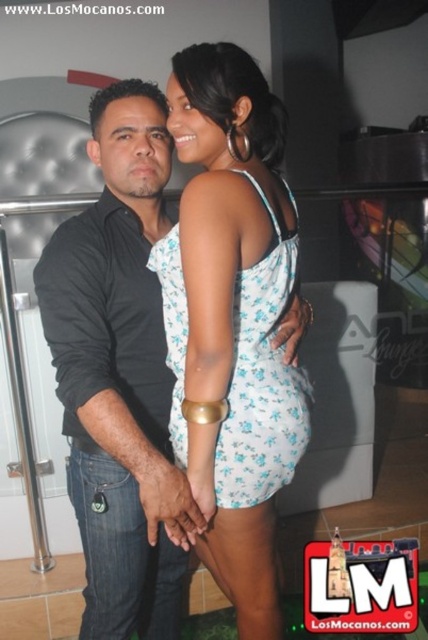
In the scene shown: Between matte black shirt at left and white floral fabric dress at center, which one appears on the left side from the viewer's perspective?

Positioned to the left is matte black shirt at left.

Does matte black shirt at left have a lesser width compared to white floral fabric dress at center?

Indeed, matte black shirt at left has a lesser width compared to white floral fabric dress at center.

At what (x,y) coordinates should I click in order to perform the action: click on matte black shirt at left. Please return your answer as a coordinate pair (x, y). Looking at the image, I should click on (119, 376).